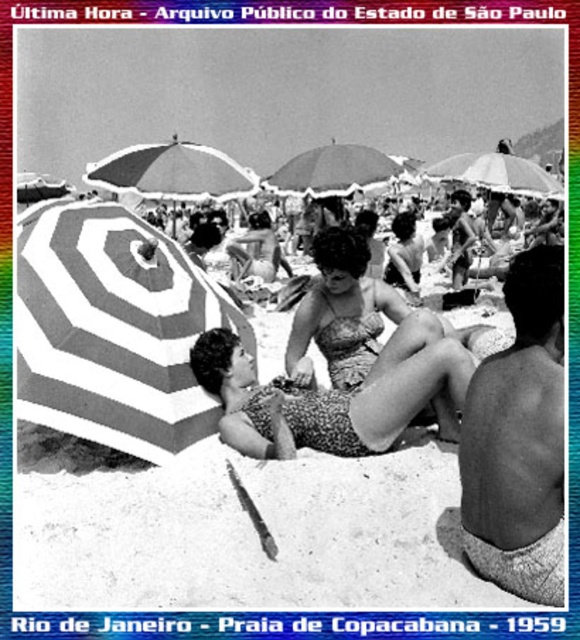
Does printed fabric bikini at center have a lesser width compared to white striped umbrella at upper center?

Yes, printed fabric bikini at center is thinner than white striped umbrella at upper center.

Does printed fabric bikini at center appear on the left side of white striped umbrella at upper center?

Correct, you'll find printed fabric bikini at center to the left of white striped umbrella at upper center.

The image size is (580, 640). What do you see at coordinates (335, 394) in the screenshot? I see `printed fabric bikini at center` at bounding box center [335, 394].

Locate an element on the screen. printed fabric bikini at center is located at coordinates (335, 394).

Can you confirm if printed fabric bikini at center is taller than white striped umbrella at center?

Incorrect, printed fabric bikini at center's height is not larger of white striped umbrella at center's.

Which is behind, point (212, 352) or point (353, 164)?

The point (353, 164) is behind.

Image resolution: width=580 pixels, height=640 pixels. In order to click on printed fabric bikini at center in this screenshot , I will do `click(335, 394)`.

In the scene shown: Is white striped umbrella at left further to camera compared to striped fabric umbrella at left?

No, white striped umbrella at left is closer to the viewer.

Between white striped umbrella at left and striped fabric umbrella at left, which one appears on the right side from the viewer's perspective?

white striped umbrella at left is more to the right.

Who is more distant from viewer, (x=27, y=224) or (x=168, y=284)?

The point (x=27, y=224) is behind.

Where is `white striped umbrella at left`? white striped umbrella at left is located at coordinates (242, 531).